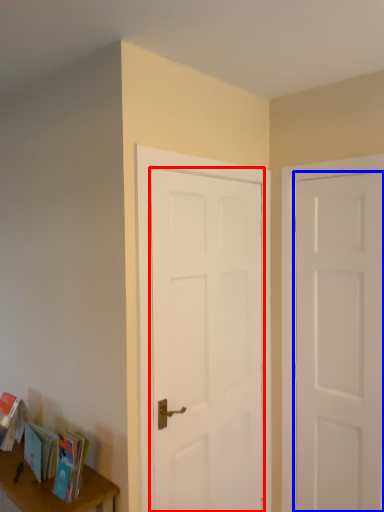
Question: Among these objects, which one is nearest to the camera, door (highlighted by a red box) or door (highlighted by a blue box)?

Choices:
 (A) door
 (B) door

Answer: (A)